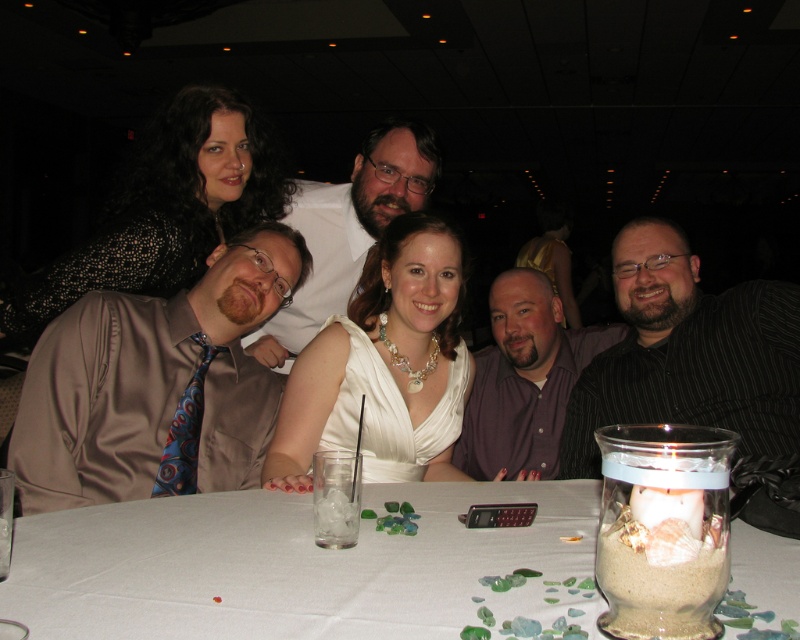
You are taking a photo of the table at the event. You want to focus on both the point at coordinates point (254, 246) and point (516, 403). Which point should you focus on first to ensure both are in clear focus?

You should focus on point (254, 246) first because it is closer to the camera than point (516, 403). By focusing on the closer point, the farther point will also be in focus due to the depth of field.

Looking at this image, you are a photographer at a formal event. You need to capture a photo of the purple satin shirt at center and the matte white shirt at center. Which one is on the right side when facing the table?

The purple satin shirt at center is positioned on the right side of matte white shirt at center, so when facing the table, the purple satin shirt at center is on the right side.

You are a photographer at a wedding reception. You notice two shirts at the center of the table. The purple satin shirt at center and the matte white shirt at center. Which shirt is closer to the camera?

The purple satin shirt at center is closer to the camera because the matte white shirt at center is behind it.